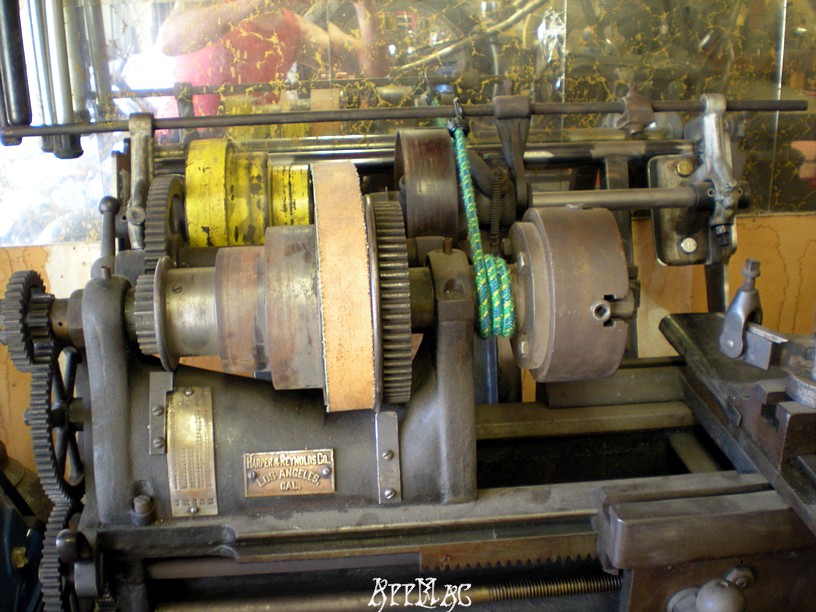
The image size is (816, 612). What are the coordinates of `mirrors` in the screenshot? It's located at (295, 62), (423, 62), (672, 57), (799, 62).